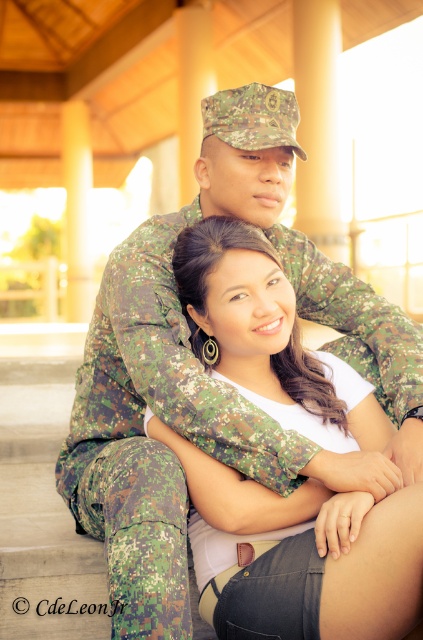
Question: Is matte camouflage shirt at center thinner than camouflage fabric uniform at center?

Choices:
 (A) no
 (B) yes

Answer: (A)

Question: Is matte camouflage shirt at center to the left of camouflage fabric uniform at center from the viewer's perspective?

Choices:
 (A) yes
 (B) no

Answer: (B)

Question: Which point is farther to the camera?

Choices:
 (A) (200, 554)
 (B) (283, 291)

Answer: (B)

Question: Which of the following is the closest to the observer?

Choices:
 (A) camouflage fabric uniform at center
 (B) matte camouflage shirt at center

Answer: (B)

Question: Is matte camouflage shirt at center in front of camouflage fabric uniform at center?

Choices:
 (A) no
 (B) yes

Answer: (B)